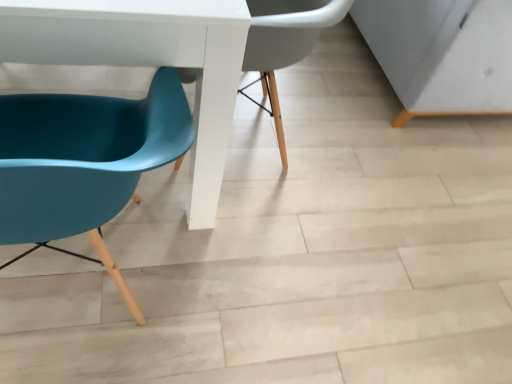
You are a GUI agent. You are given a task and a screenshot of the screen. Output one action in this format:
    pyautogui.click(x=<x>, y=<y>)
    Task: Click on the free spot below teal plastic chair at left, the 1th chair viewed from the top (from a real-world perspective)
    This screenshot has width=512, height=384.
    Given the screenshot: What is the action you would take?
    pyautogui.click(x=253, y=135)